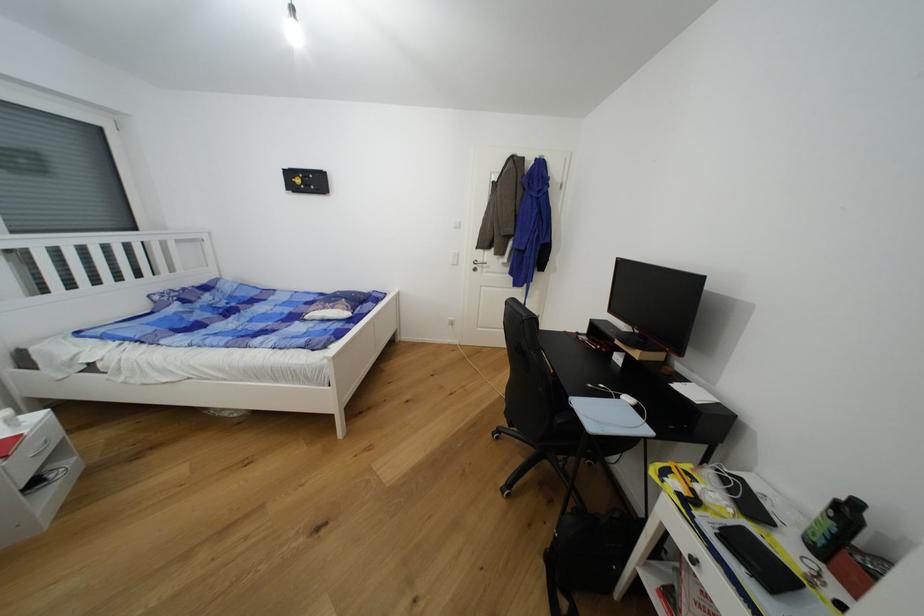
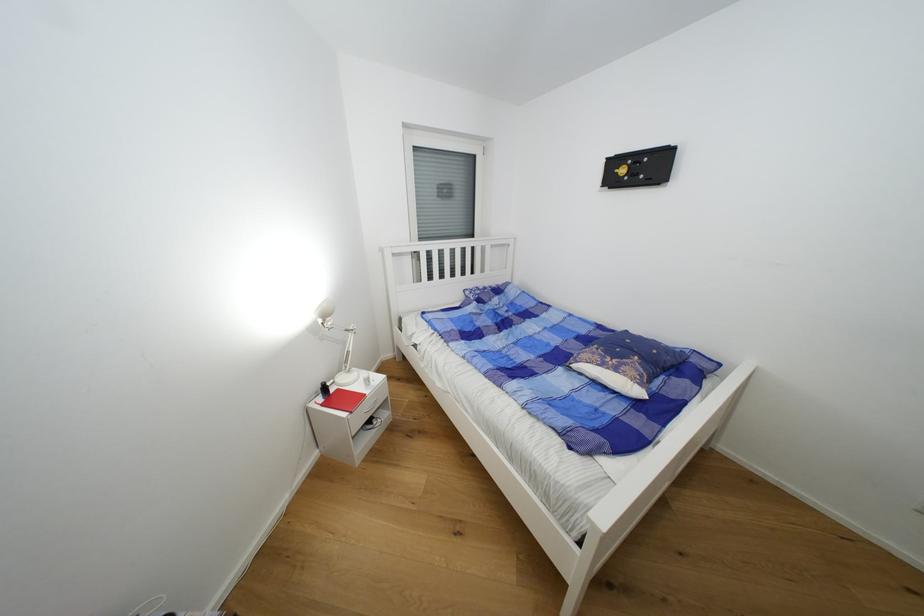
Where in the second image is the point corresponding to point (337, 310) from the first image?

(622, 371)